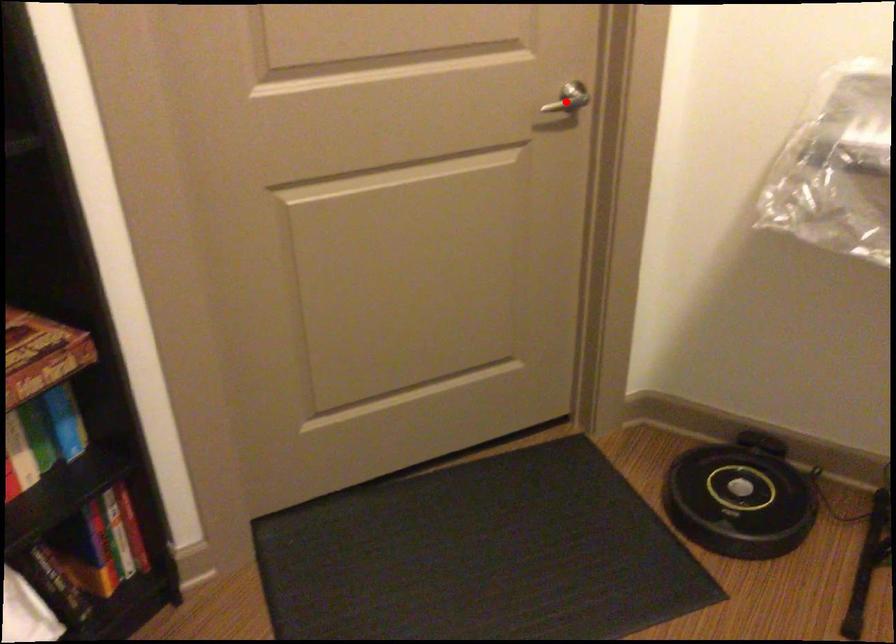
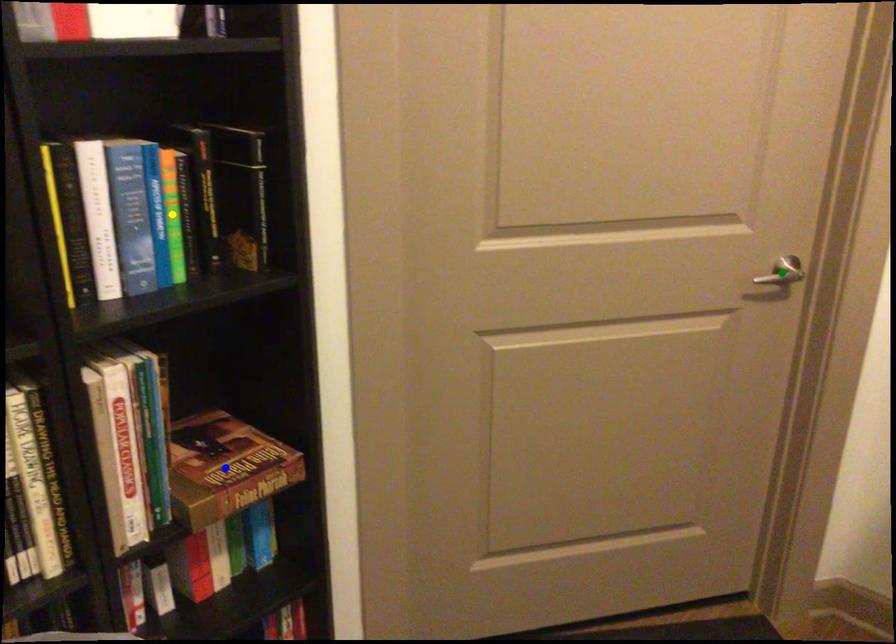
Question: I am providing you with two images of the same scene from different viewpoints. A red point is marked on the first image. You are given multiple points on the second image. Which mark in image 2 goes with the point in image 1?

Choices:
 (A) green point
 (B) blue point
 (C) yellow point

Answer: (A)